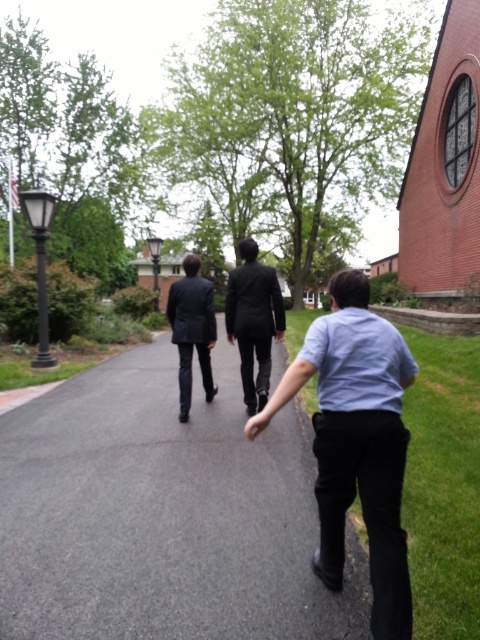
Between matte black suit at center and dark suit at center, which one is positioned lower?

dark suit at center

Is matte black suit at center taller than dark suit at center?

Yes.

Consider the image. Measure the distance between matte black suit at center and camera.

matte black suit at center and camera are 20.51 feet apart from each other.

The width and height of the screenshot is (480, 640). I want to click on matte black suit at center, so click(253, 321).

How distant is gray asphalt pavement at center from matte black suit at center?

gray asphalt pavement at center and matte black suit at center are 10.93 feet apart.

Between point (295, 499) and point (264, 308), which one is positioned in front?

Point (295, 499) is more forward.

Between point (93, 472) and point (273, 323), which one is positioned behind?

The point (273, 323) is behind.

The width and height of the screenshot is (480, 640). Identify the location of gray asphalt pavement at center. (163, 515).

Identify the location of gray asphalt pavement at center. Image resolution: width=480 pixels, height=640 pixels. (163, 515).

Is point (176, 616) farther from camera compared to point (347, 346)?

Yes.

Identify the location of gray asphalt pavement at center. This screenshot has height=640, width=480. (163, 515).